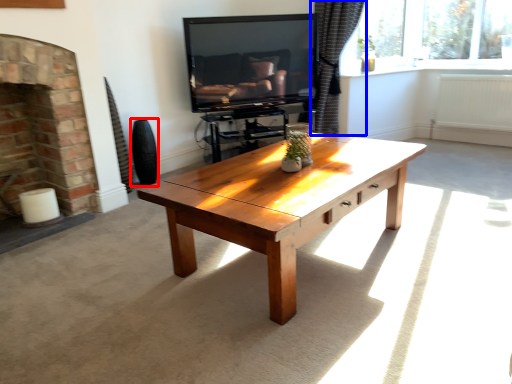
Question: Which point is closer to the camera, vase (highlighted by a red box) or curtain (highlighted by a blue box)?

Choices:
 (A) vase
 (B) curtain

Answer: (A)